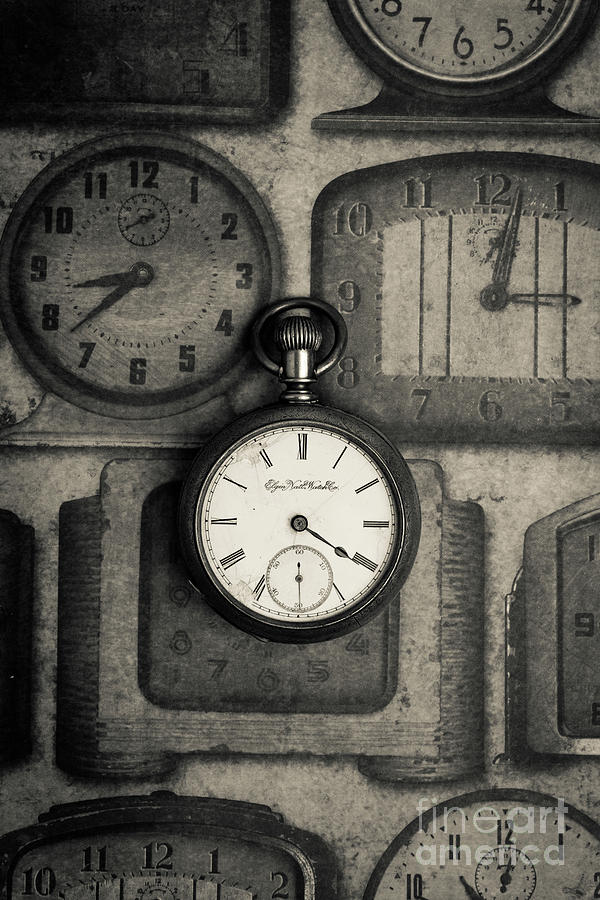
Find the location of a particular element. This screenshot has height=900, width=600. clocks is located at coordinates (297, 515), (415, 877).